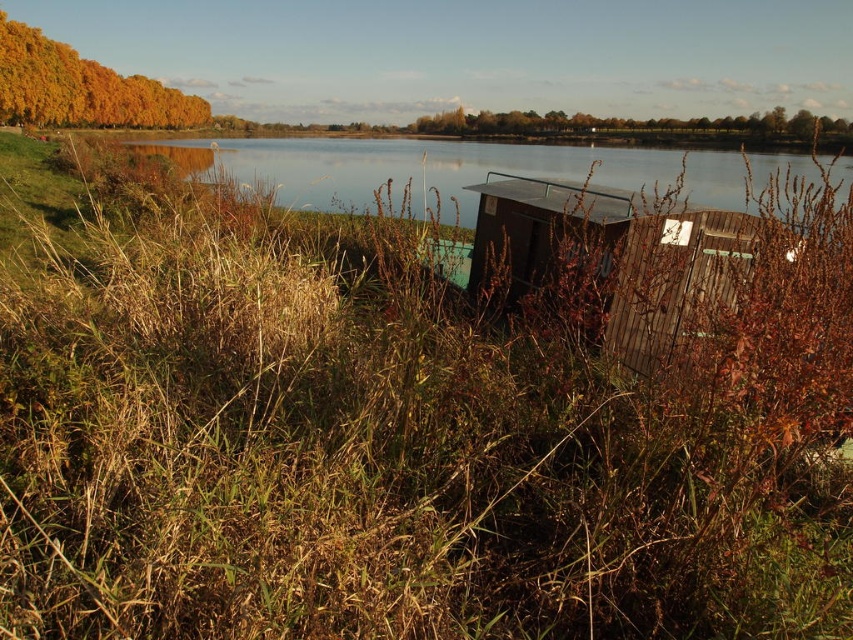
You are a painter setting up your easel to capture the serene lakeside scene. You want to place your easel so that both the wooden shed at center and the transparent glass water at center are visible in your painting. Based on their positions, which object should you position closer to the left side of your canvas?

The wooden shed at center is positioned on the left side of transparent glass water at center, so to accurately represent their arrangement, you should place the wooden shed at center closer to the left side of your canvas.

You are standing at the lakeside and want to take a photo of the transparent glass water at center and the green leafy tree at upper center. Which object should you focus on first if you want both to be in sharp focus?

You should focus on the green leafy tree at upper center first because it is farther away from the transparent glass water at center, ensuring both will be in focus when using depth of field.